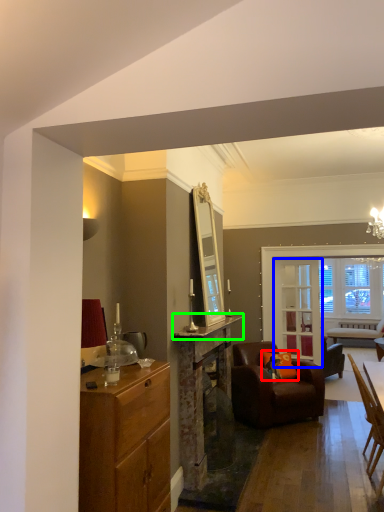
Question: Which object is the farthest from pillow (highlighted by a red box)? Choose among these: glass door (highlighted by a blue box) or counter top (highlighted by a green box).

Choices:
 (A) glass door
 (B) counter top

Answer: (B)